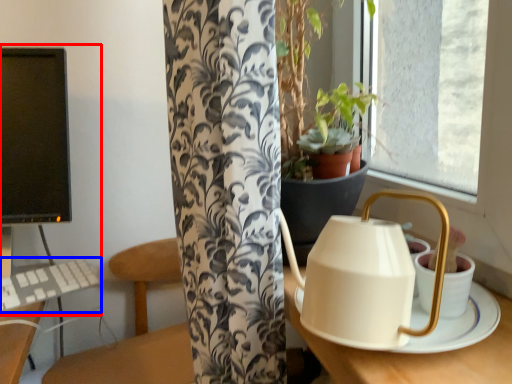
Question: Which of the following is the closest to the observer, desktop computer (highlighted by a red box) or keyboard (highlighted by a blue box)?

Choices:
 (A) desktop computer
 (B) keyboard

Answer: (B)